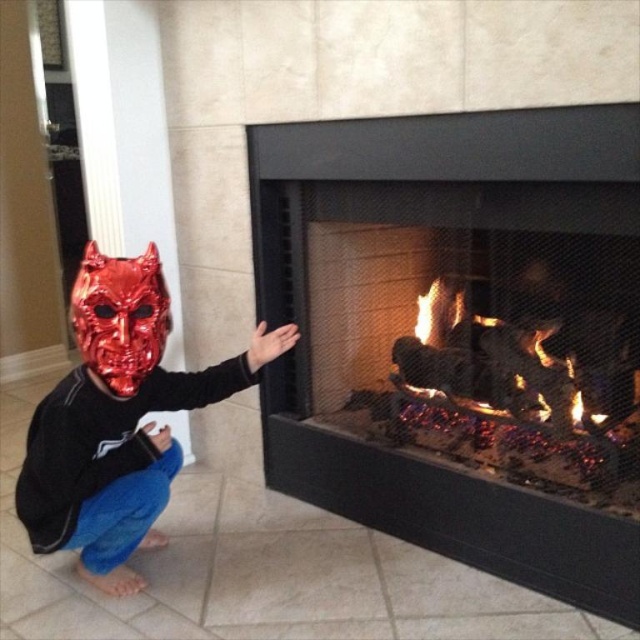
Question: Among these objects, which one is nearest to the camera?

Choices:
 (A) shiny metallic mask at left
 (B) metallic red mask at left

Answer: (B)

Question: Which point is closer to the camera?

Choices:
 (A) charcoal black fireplace at center
 (B) metallic red mask at left
 (C) shiny metallic mask at left

Answer: (A)

Question: Which point is farther from the camera taking this photo?

Choices:
 (A) coord(88,486)
 (B) coord(288,464)

Answer: (B)

Question: Can you confirm if charcoal black fireplace at center is positioned to the right of shiny metallic mask at left?

Choices:
 (A) no
 (B) yes

Answer: (B)

Question: Does charcoal black fireplace at center have a larger size compared to shiny metallic mask at left?

Choices:
 (A) yes
 (B) no

Answer: (A)

Question: Does charcoal black fireplace at center appear under metallic red mask at left?

Choices:
 (A) yes
 (B) no

Answer: (A)